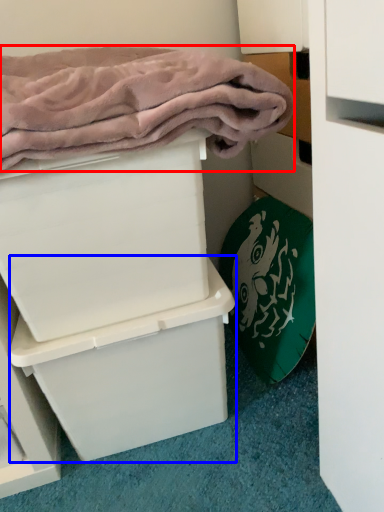
Question: Which object appears farthest to the camera in this image, bath towel (highlighted by a red box) or box (highlighted by a blue box)?

Choices:
 (A) bath towel
 (B) box

Answer: (B)